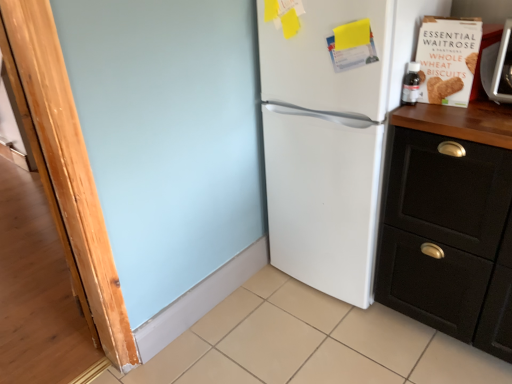
Question: Is the depth of beige tile at lower center greater than that of white matte refrigerator at center?

Choices:
 (A) yes
 (B) no

Answer: (B)

Question: From the image's perspective, is beige tile at lower center located beneath white matte refrigerator at center?

Choices:
 (A) no
 (B) yes

Answer: (B)

Question: From the image's perspective, is beige tile at lower center located above white matte refrigerator at center?

Choices:
 (A) no
 (B) yes

Answer: (A)

Question: Is beige tile at lower center not within white matte refrigerator at center?

Choices:
 (A) yes
 (B) no

Answer: (A)

Question: From a real-world perspective, is beige tile at lower center located higher than white matte refrigerator at center?

Choices:
 (A) yes
 (B) no

Answer: (B)

Question: Is white matte refrigerator at center inside the boundaries of beige tile at lower center, or outside?

Choices:
 (A) outside
 (B) inside

Answer: (A)

Question: Looking at the image, does white matte refrigerator at center seem bigger or smaller compared to beige tile at lower center?

Choices:
 (A) small
 (B) big

Answer: (B)

Question: Is point (326, 26) positioned closer to the camera than point (425, 357)?

Choices:
 (A) farther
 (B) closer

Answer: (B)

Question: Considering their positions, is white matte refrigerator at center located in front of or behind beige tile at lower center?

Choices:
 (A) front
 (B) behind

Answer: (B)

Question: Considering the positions of point (281, 64) and point (497, 276), is point (281, 64) closer or farther from the camera than point (497, 276)?

Choices:
 (A) closer
 (B) farther

Answer: (B)

Question: Which is correct: white matte refrigerator at center is inside black matte cabinet at right, or outside of it?

Choices:
 (A) inside
 (B) outside

Answer: (B)

Question: In terms of width, does white matte refrigerator at center look wider or thinner when compared to black matte cabinet at right?

Choices:
 (A) wide
 (B) thin

Answer: (A)

Question: From a real-world perspective, is white matte refrigerator at center above or below black matte cabinet at right?

Choices:
 (A) below
 (B) above

Answer: (B)

Question: Is beige tile at lower center wider or thinner than white matte refrigerator at center?

Choices:
 (A) thin
 (B) wide

Answer: (B)

Question: From the image's perspective, is beige tile at lower center positioned above or below white matte refrigerator at center?

Choices:
 (A) below
 (B) above

Answer: (A)